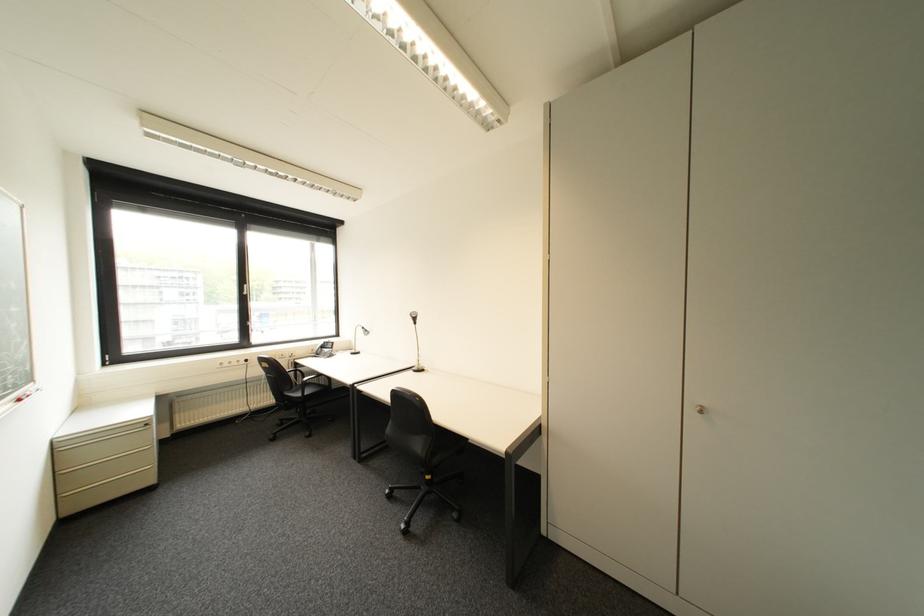
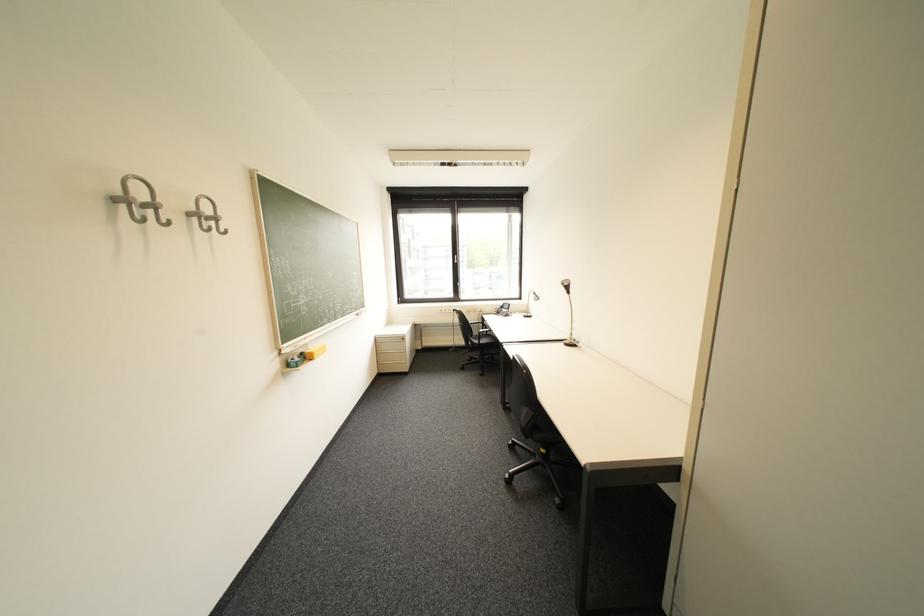
The point at (420, 373) is marked in the first image. Where is the corresponding point in the second image?

(572, 345)